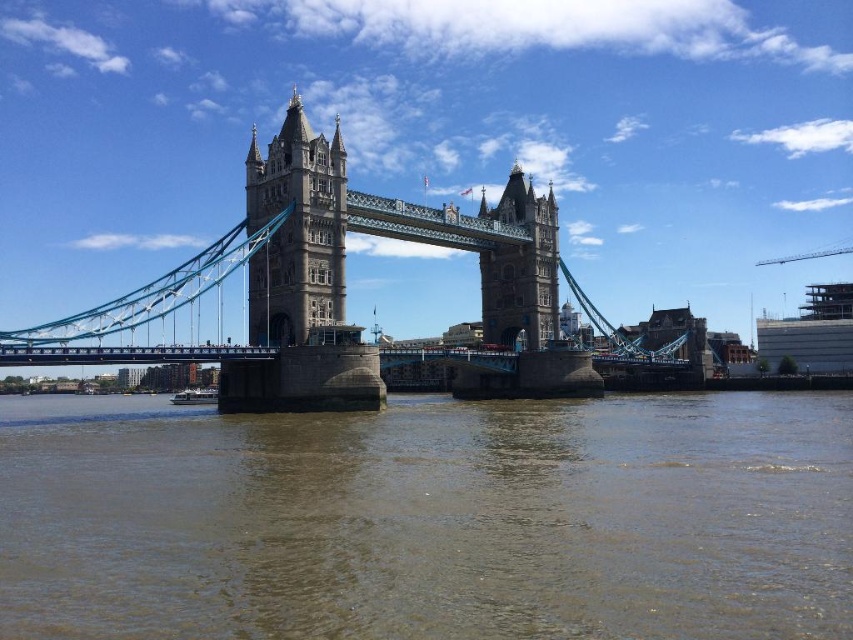
Question: Which point appears farthest from the camera in this image?

Choices:
 (A) (154, 356)
 (B) (514, 324)
 (C) (343, 157)

Answer: (B)

Question: Which point is farther to the camera?

Choices:
 (A) stone stonework tower at center
 (B) brown sedimentary water at center

Answer: (A)

Question: Which point appears farthest from the camera in this image?

Choices:
 (A) (248, 161)
 (B) (512, 289)
 (C) (299, 166)

Answer: (B)

Question: Can you confirm if brown sedimentary water at center is thinner than brown stone tower at center?

Choices:
 (A) no
 (B) yes

Answer: (A)

Question: Does stone stonework tower at center have a greater width compared to brown stone tower at center?

Choices:
 (A) yes
 (B) no

Answer: (A)

Question: Is brown sedimentary water at center in front of brown stone tower at center?

Choices:
 (A) yes
 (B) no

Answer: (A)